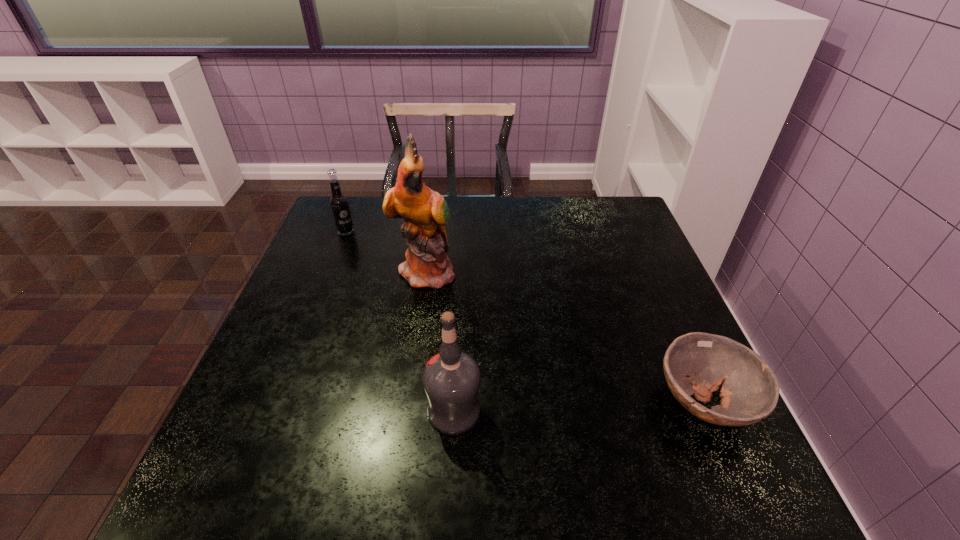
The width and height of the screenshot is (960, 540). I want to click on free area in between the bowl and the parrot, so tap(565, 336).

The width and height of the screenshot is (960, 540). I want to click on free space between the second tallest object and the parrot, so click(441, 341).

This screenshot has width=960, height=540. I want to click on free spot between the shortest object and the second tallest object, so click(x=579, y=406).

Identify the location of vacant area that lies between the parrot and the third shortest object. The width and height of the screenshot is (960, 540). (441, 341).

At what (x,y) coordinates should I click in order to perform the action: click on vacant area that lies between the bowl and the vodka. Please return your answer as a coordinate pair (x, y). The height and width of the screenshot is (540, 960). Looking at the image, I should click on pyautogui.click(x=579, y=406).

The image size is (960, 540). Identify the location of free spot between the parrot and the leftmost object. tap(386, 251).

Locate an element on the screen. free space that is in between the shortest object and the tallest object is located at coordinates (565, 336).

You are a GUI agent. You are given a task and a screenshot of the screen. Output one action in this format:
    pyautogui.click(x=<x>, y=<y>)
    Task: Click on the vacant point located between the farthest object and the shortest object
    This screenshot has height=540, width=960.
    Given the screenshot: What is the action you would take?
    pyautogui.click(x=525, y=316)

Locate an element on the screen. vacant space that's between the leftmost object and the parrot is located at coordinates (386, 251).

At what (x,y) coordinates should I click in order to perform the action: click on vacant area between the shortest object and the parrot. Please return your answer as a coordinate pair (x, y). This screenshot has height=540, width=960. Looking at the image, I should click on (565, 336).